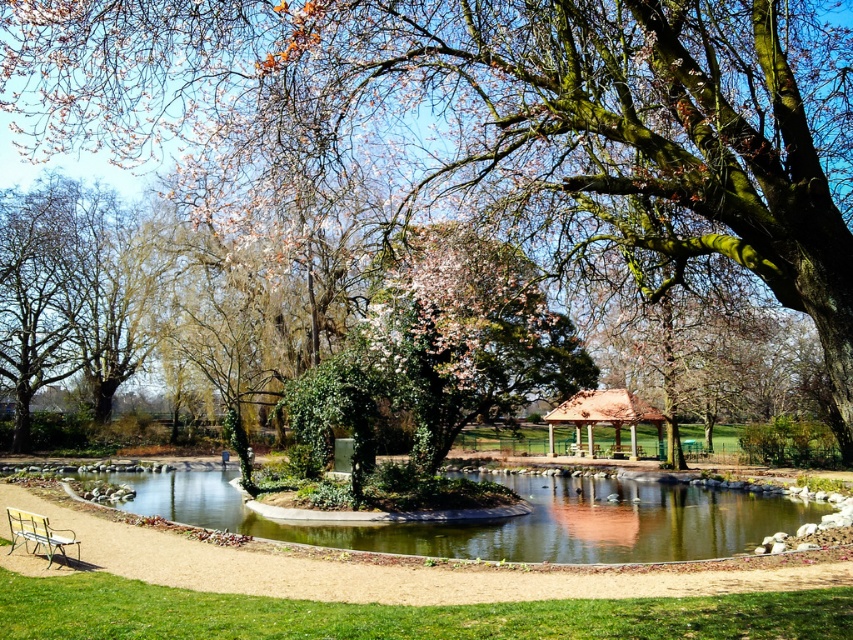
Between point (619, 408) and point (18, 518), which one is positioned behind?

Point (619, 408)

Who is shorter, brown wooden gazebo at center or wooden park bench at lower left?

wooden park bench at lower left is shorter.

Who is more forward, [550,412] or [36,513]?

Point [36,513]

Identify the location of brown wooden gazebo at center. The height and width of the screenshot is (640, 853). (602, 417).

Is point (613, 148) less distant than point (759, 499)?

Yes.

Locate an element on the screen. Image resolution: width=853 pixels, height=640 pixels. green mossy tree at center is located at coordinates tap(490, 120).

Who is higher up, green mossy tree at center or wooden park bench at lower left?

green mossy tree at center

Is point (181, 132) closer to viewer compared to point (22, 518)?

No, (181, 132) is behind (22, 518).

Is point (747, 58) positioned in front of point (32, 525)?

Yes, point (747, 58) is in front of point (32, 525).

This screenshot has height=640, width=853. What are the coordinates of `green mossy tree at center` in the screenshot? It's located at coord(490,120).